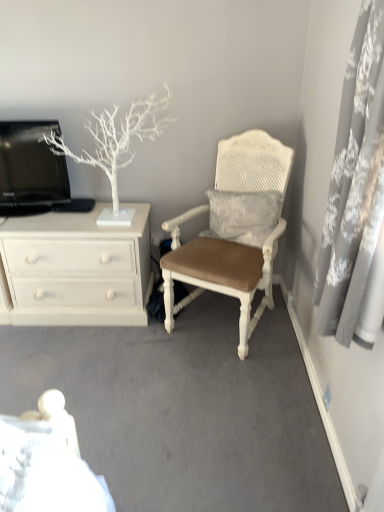
Measure the distance between black glossy television at upper left and camera.

The distance of black glossy television at upper left from camera is 7.40 feet.

This screenshot has height=512, width=384. I want to click on black glossy television at upper left, so click(x=31, y=166).

The height and width of the screenshot is (512, 384). In order to click on curtain in front of the white matte tree at upper left in this screenshot , I will do `click(354, 182)`.

Is white matte tree at upper left far from gray lace curtain at right?

Yes, white matte tree at upper left and gray lace curtain at right are quite far apart.

Between white matte tree at upper left and gray lace curtain at right, which one is positioned behind?

white matte tree at upper left.

Is white textured cushioned chair at center located outside gray lace curtain at right?

Indeed, white textured cushioned chair at center is completely outside gray lace curtain at right.

From the picture: From a real-world perspective, which is physically below, white textured cushioned chair at center or gray lace curtain at right?

white textured cushioned chair at center is physically lower.

How many degrees apart are the facing directions of white textured cushioned chair at center and gray lace curtain at right?

There is a 60.7-degree angle between the facing directions of white textured cushioned chair at center and gray lace curtain at right.

Considering the sizes of objects white textured cushioned chair at center and gray lace curtain at right in the image provided, who is bigger, white textured cushioned chair at center or gray lace curtain at right?

Bigger between the two is white textured cushioned chair at center.

Is white matte tree at upper left turned away from black glossy television at upper left?

That's not correct — white matte tree at upper left is not looking away from black glossy television at upper left.

From a real-world perspective, is white matte tree at upper left located beneath black glossy television at upper left?

Incorrect, from a real-world perspective, white matte tree at upper left is higher than black glossy television at upper left.

Image resolution: width=384 pixels, height=512 pixels. In the image, there is a white matte tree at upper left. Find the location of `television below it (from the image's perspective)`. television below it (from the image's perspective) is located at coordinates (31, 166).

Which is nearer, [113,183] or [22,185]?

The point [113,183] is closer.

I want to click on curtain that appears on the right of black glossy television at upper left, so click(x=354, y=182).

From the image's perspective, is black glossy television at upper left below gray lace curtain at right?

Incorrect, from the image's perspective, black glossy television at upper left is higher than gray lace curtain at right.

Is black glossy television at upper left next to gray lace curtain at right?

black glossy television at upper left is not next to gray lace curtain at right, and they're not touching.

Based on their positions, is black glossy television at upper left located to the left or right of gray lace curtain at right?

Based on their positions, black glossy television at upper left is located to the left of gray lace curtain at right.

Does white painted wood chest of drawers at left have a smaller size compared to gray lace curtain at right?

Incorrect, white painted wood chest of drawers at left is not smaller in size than gray lace curtain at right.

Relative to gray lace curtain at right, is white painted wood chest of drawers at left in front or behind?

Clearly, white painted wood chest of drawers at left is behind gray lace curtain at right.

From the image's perspective, is white painted wood chest of drawers at left below gray lace curtain at right?

Yes, from the image's perspective, white painted wood chest of drawers at left is beneath gray lace curtain at right.

Image resolution: width=384 pixels, height=512 pixels. In order to click on the chest of drawers behind the white matte tree at upper left in this screenshot , I will do `click(77, 268)`.

Does white painted wood chest of drawers at left touch white matte tree at upper left?

There is a gap between white painted wood chest of drawers at left and white matte tree at upper left.

Could you tell me if white painted wood chest of drawers at left is turned towards white matte tree at upper left?

No, white painted wood chest of drawers at left is not oriented towards white matte tree at upper left.

Between point (133, 267) and point (64, 144), which one is positioned behind?

The point (64, 144) is more distant.

From the picture: Are white matte tree at upper left and white textured cushioned chair at center located far from each other?

No, white matte tree at upper left is in close proximity to white textured cushioned chair at center.

Is white matte tree at upper left to the left of white textured cushioned chair at center from the viewer's perspective?

Indeed, white matte tree at upper left is positioned on the left side of white textured cushioned chair at center.

Is white textured cushioned chair at center located within white matte tree at upper left?

Actually, white textured cushioned chair at center is outside white matte tree at upper left.

Who is shorter, white matte tree at upper left or white textured cushioned chair at center?

white matte tree at upper left.

Locate an element on the screen. tree on the left of gray lace curtain at right is located at coordinates (117, 137).

Find the location of a particular element. chair behind the gray lace curtain at right is located at coordinates (220, 271).

Considering their positions, is black glossy television at upper left positioned further to gray lace curtain at right than white matte tree at upper left?

black glossy television at upper left.

Looking at this image, estimate the real-world distances between objects in this image. Which object is closer to white textured cushioned chair at center, white matte tree at upper left or gray lace curtain at right?

white matte tree at upper left is positioned closer to the anchor white textured cushioned chair at center.

Consider the image. When comparing their distances from gray lace curtain at right, does white painted wood chest of drawers at left or white matte tree at upper left seem further?

The object further to gray lace curtain at right is white painted wood chest of drawers at left.

Considering their positions, is white painted wood chest of drawers at left positioned further to gray lace curtain at right than black glossy television at upper left?

Among the two, black glossy television at upper left is located further to gray lace curtain at right.

Considering their positions, is white matte tree at upper left positioned further to black glossy television at upper left than white painted wood chest of drawers at left?

The object further to black glossy television at upper left is white painted wood chest of drawers at left.

When comparing their distances from white textured cushioned chair at center, does white matte tree at upper left or white painted wood chest of drawers at left seem closer?

The object closer to white textured cushioned chair at center is white painted wood chest of drawers at left.

When comparing their distances from gray lace curtain at right, does white painted wood chest of drawers at left or white textured cushioned chair at center seem closer?

Based on the image, white textured cushioned chair at center appears to be nearer to gray lace curtain at right.

Considering their positions, is gray lace curtain at right positioned further to white matte tree at upper left than black glossy television at upper left?

The object further to white matte tree at upper left is gray lace curtain at right.

What are the coordinates of `television positioned between gray lace curtain at right and white painted wood chest of drawers at left from near to far` in the screenshot? It's located at (31, 166).

Where is `chest of drawers between black glossy television at upper left and white textured cushioned chair at center in the horizontal direction`? chest of drawers between black glossy television at upper left and white textured cushioned chair at center in the horizontal direction is located at coordinates (77, 268).

You are a GUI agent. You are given a task and a screenshot of the screen. Output one action in this format:
    pyautogui.click(x=<x>, y=<y>)
    Task: Click on the television between white matte tree at upper left and white painted wood chest of drawers at left in the vertical direction
    
    Given the screenshot: What is the action you would take?
    pyautogui.click(x=31, y=166)

Identify the location of tree between white painted wood chest of drawers at left and white textured cushioned chair at center from left to right. The width and height of the screenshot is (384, 512). (x=117, y=137).